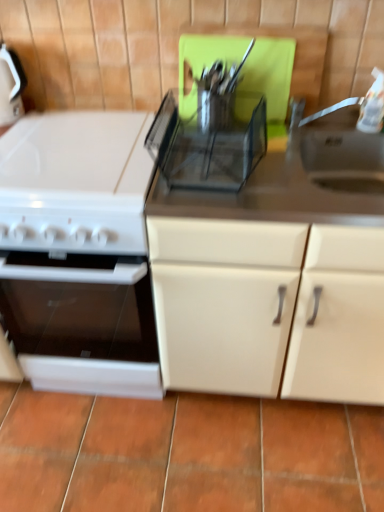
What is the approximate height of transparent plastic utensil rack at center?

It is 4.04 inches.

Measure the distance between matte white cabinet at center and camera.

3.30 feet.

This screenshot has height=512, width=384. What do you see at coordinates (270, 308) in the screenshot?
I see `matte white cabinet at center` at bounding box center [270, 308].

Where is `transparent plastic utensil rack at center`? Image resolution: width=384 pixels, height=512 pixels. transparent plastic utensil rack at center is located at coordinates (209, 142).

How distant is white glossy oven at left from matte white cabinet at center?

12.68 inches.

From the image's perspective, which one is positioned higher, white glossy oven at left or matte white cabinet at center?

From the image's view, matte white cabinet at center is above.

Looking at this image, choose the correct answer: Is white glossy oven at left inside matte white cabinet at center or outside it?

white glossy oven at left is located beyond the bounds of matte white cabinet at center.

From a real-world perspective, is white glossy oven at left above or below matte white cabinet at center?

Clearly, from a real-world perspective, white glossy oven at left is below matte white cabinet at center.

From the picture: Is transparent plastic utensil rack at center at the back of terracotta tile at lower center?

No, terracotta tile at lower center's orientation is not away from transparent plastic utensil rack at center.

Is terracotta tile at lower center not near transparent plastic utensil rack at center?

No, terracotta tile at lower center is not far from transparent plastic utensil rack at center.

Locate an element on the screen. The width and height of the screenshot is (384, 512). appliance on the right of terracotta tile at lower center is located at coordinates (209, 142).

Considering the points (202, 118) and (37, 118), which point is behind, point (202, 118) or point (37, 118)?

The point (37, 118) is more distant.

Considering the sizes of transparent plastic utensil rack at center and white glossy oven at left in the image, is transparent plastic utensil rack at center wider or thinner than white glossy oven at left?

Clearly, transparent plastic utensil rack at center has less width compared to white glossy oven at left.

Is transparent plastic utensil rack at center looking in the opposite direction of white glossy oven at left?

No, transparent plastic utensil rack at center is not facing the opposite direction of white glossy oven at left.

At what (x,y) coordinates should I click in order to perform the action: click on kitchen appliance behind the transparent plastic utensil rack at center. Please return your answer as a coordinate pair (x, y). The height and width of the screenshot is (512, 384). Looking at the image, I should click on (76, 194).

Considering the sizes of objects white glossy oven at left and transparent plastic utensil rack at center in the image provided, who is bigger, white glossy oven at left or transparent plastic utensil rack at center?

Bigger between the two is white glossy oven at left.

Is transparent plastic utensil rack at center at the back of white glossy oven at left?

No, white glossy oven at left's orientation is not away from transparent plastic utensil rack at center.

Between terracotta tile at lower center and white glossy oven at left, which one has smaller width?

white glossy oven at left is thinner.

From a real-world perspective, is terracotta tile at lower center positioned under white glossy oven at left based on gravity?

Yes, from a real-world perspective, terracotta tile at lower center is below white glossy oven at left.

Between point (170, 451) and point (152, 160), which one is positioned behind?

The point (170, 451) is farther.

Between matte white cabinet at center and transparent plastic utensil rack at center, which one appears on the right side from the viewer's perspective?

Positioned to the right is matte white cabinet at center.

Find the location of a particular element. appliance on the left of matte white cabinet at center is located at coordinates (209, 142).

From the image's perspective, is matte white cabinet at center located beneath transparent plastic utensil rack at center?

Indeed, from the image's perspective, matte white cabinet at center is shown beneath transparent plastic utensil rack at center.

Would you say matte white cabinet at center contains transparent plastic utensil rack at center?

No.

Is white glossy oven at left bigger than terracotta tile at lower center?

Indeed, white glossy oven at left has a larger size compared to terracotta tile at lower center.

Does point (69, 149) come behind point (152, 426)?

No.

Does white glossy oven at left turn towards terracotta tile at lower center?

No.

Locate an element on the screen. This screenshot has height=512, width=384. cabinetry above the white glossy oven at left (from the image's perspective) is located at coordinates (270, 308).

This screenshot has height=512, width=384. Identify the location of appliance on the right of terracotta tile at lower center. (209, 142).

Estimate the real-world distances between objects in this image. Which object is closer to transparent plastic utensil rack at center, terracotta tile at lower center or white glossy oven at left?

white glossy oven at left is closer to transparent plastic utensil rack at center.

Based on their spatial positions, is white glossy oven at left or terracotta tile at lower center further from transparent plastic utensil rack at center?

Based on the image, terracotta tile at lower center appears to be further to transparent plastic utensil rack at center.

Based on their spatial positions, is white glossy oven at left or terracotta tile at lower center closer to matte white cabinet at center?

white glossy oven at left is closer to matte white cabinet at center.

Estimate the real-world distances between objects in this image. Which object is closer to transparent plastic utensil rack at center, white glossy oven at left or matte white cabinet at center?

white glossy oven at left is positioned closer to the anchor transparent plastic utensil rack at center.

Estimate the real-world distances between objects in this image. Which object is further from terracotta tile at lower center, white glossy oven at left or matte white cabinet at center?

Among the two, white glossy oven at left is located further to terracotta tile at lower center.

When comparing their distances from matte white cabinet at center, does transparent plastic utensil rack at center or terracotta tile at lower center seem further?

The object further to matte white cabinet at center is terracotta tile at lower center.

Based on their spatial positions, is terracotta tile at lower center or matte white cabinet at center further from white glossy oven at left?

Based on the image, terracotta tile at lower center appears to be further to white glossy oven at left.

Which object lies nearer to the anchor point transparent plastic utensil rack at center, matte white cabinet at center or white glossy oven at left?

The object closer to transparent plastic utensil rack at center is white glossy oven at left.

Locate an element on the screen. This screenshot has width=384, height=512. kitchen appliance between matte white cabinet at center and terracotta tile at lower center from top to bottom is located at coordinates (76, 194).

Locate an element on the screen. The height and width of the screenshot is (512, 384). cabinetry between transparent plastic utensil rack at center and terracotta tile at lower center in the vertical direction is located at coordinates (270, 308).

Where is `appliance located between white glossy oven at left and matte white cabinet at center in the left-right direction`? appliance located between white glossy oven at left and matte white cabinet at center in the left-right direction is located at coordinates (209, 142).

I want to click on kitchen appliance between transparent plastic utensil rack at center and terracotta tile at lower center from top to bottom, so pos(76,194).